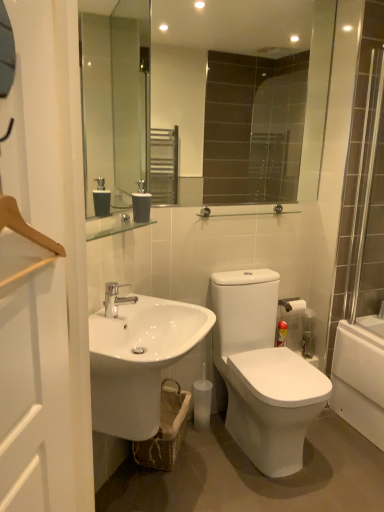
You are a GUI agent. You are given a task and a screenshot of the screen. Output one action in this format:
    pyautogui.click(x=<x>, y=<y>)
    Task: Click on the unoccupied space behind silver metallic faucet at center
    
    Given the screenshot: What is the action you would take?
    pyautogui.click(x=139, y=306)